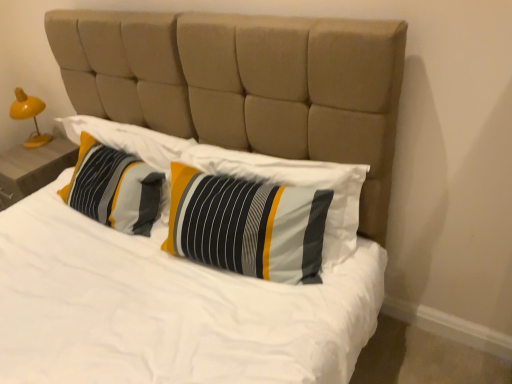
Question: In terms of size, does yellow plastic lamp at left appear bigger or smaller than striped fabric pillow at center, the second pillow in the left-to-right sequence?

Choices:
 (A) big
 (B) small

Answer: (B)

Question: Does point (22, 89) appear closer or farther from the camera than point (200, 223)?

Choices:
 (A) farther
 (B) closer

Answer: (A)

Question: Based on their relative distances, which object is farther from the yellow plastic lamp at left?

Choices:
 (A) striped fabric pillow at center, which ranks as the 2th pillow in right-to-left order
 (B) yellow wood nightstand at left
 (C) striped fabric pillow at center, placed as the 1th pillow when sorted from right to left

Answer: (C)

Question: Based on their relative distances, which object is nearer to the striped fabric pillow at center, the second pillow in the left-to-right sequence?

Choices:
 (A) striped fabric pillow at center, the 1th pillow viewed from the left
 (B) yellow wood nightstand at left
 (C) yellow plastic lamp at left

Answer: (A)